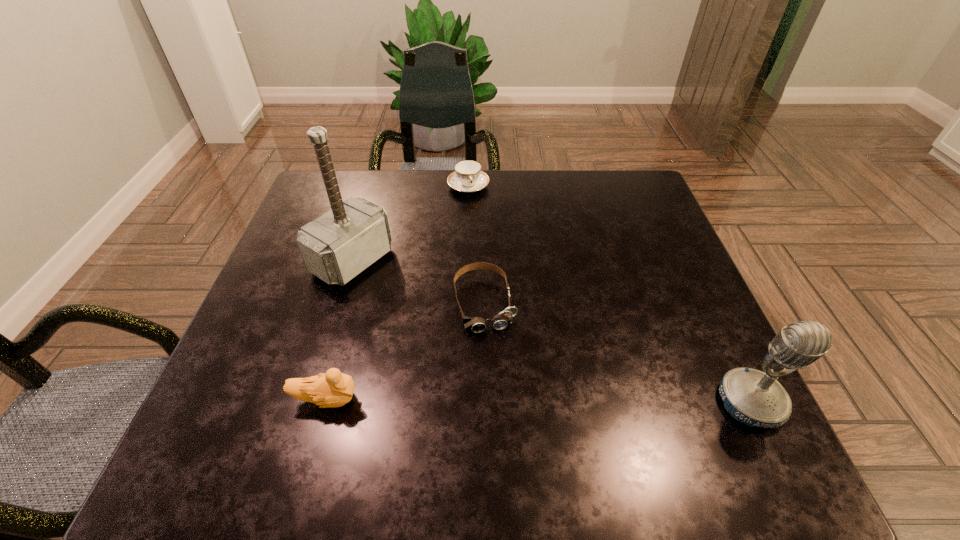
This screenshot has width=960, height=540. In order to click on free space located on the front-facing side of the goggles in this screenshot , I will do `click(497, 367)`.

The width and height of the screenshot is (960, 540). What are the coordinates of `vacant space situated on the front-facing side of the goggles` in the screenshot? It's located at (503, 390).

Where is `free location located 0.070m on the front-facing side of the goggles`? free location located 0.070m on the front-facing side of the goggles is located at coordinates [496, 363].

Identify the location of vacant space situated on the side with the handle of the farthest object. The height and width of the screenshot is (540, 960). (476, 211).

The height and width of the screenshot is (540, 960). Identify the location of vacant space situated 0.100m on the side with the handle of the farthest object. (479, 219).

Find the location of `vacant space situated on the side with the handle of the farthest object`. vacant space situated on the side with the handle of the farthest object is located at coordinates (500, 283).

This screenshot has height=540, width=960. Identify the location of object present at the far edge. (467, 177).

Locate an element on the screen. This screenshot has width=960, height=540. duckling at the near edge is located at coordinates (331, 389).

This screenshot has width=960, height=540. Identify the location of microphone present at the near edge. (754, 398).

I want to click on duckling located in the left edge section of the desktop, so click(x=331, y=389).